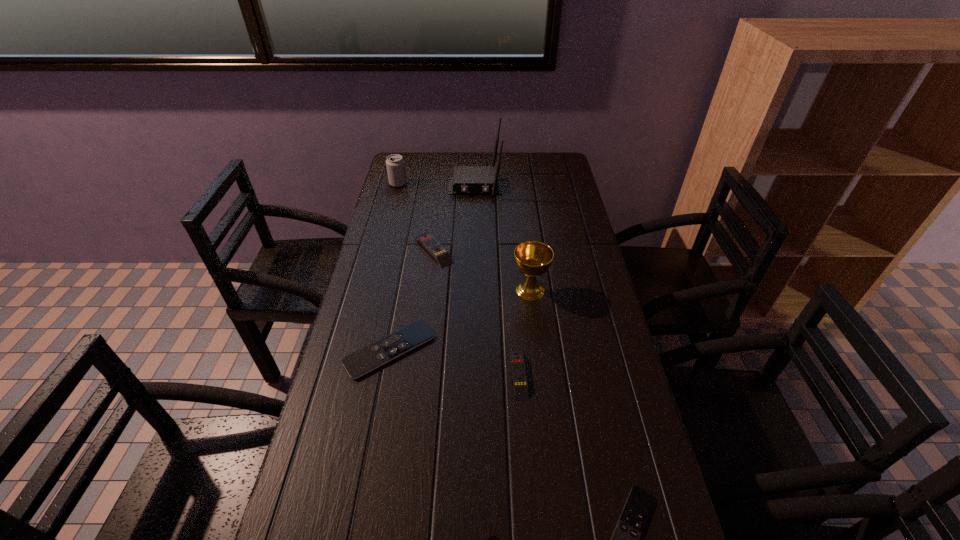
Image resolution: width=960 pixels, height=540 pixels. I want to click on object present at the far left corner, so click(395, 164).

The width and height of the screenshot is (960, 540). What are the coordinates of `free region at the far edge of the desktop` in the screenshot? It's located at (521, 171).

Where is `vacant space at the left edge of the desktop`? vacant space at the left edge of the desktop is located at coordinates (396, 271).

Locate an element on the screen. blank space at the right edge of the desktop is located at coordinates (545, 184).

Find the location of a particular element. This screenshot has height=540, width=960. blank space at the far right corner of the desktop is located at coordinates (566, 164).

Locate an element on the screen. Image resolution: width=960 pixels, height=540 pixels. empty space that is in between the gold chalice and the can is located at coordinates (465, 237).

Where is `free spot between the farthest remote control and the can`? The height and width of the screenshot is (540, 960). free spot between the farthest remote control and the can is located at coordinates (416, 217).

The image size is (960, 540). Identify the location of vacant point located between the router and the second remote control from right to left. (497, 280).

Where is `free space between the can and the router`? This screenshot has height=540, width=960. free space between the can and the router is located at coordinates (437, 185).

Identify which object is the third closest to the shortest object. Please provide its 2D coordinates. Your answer should be formatted as a tuple, i.e. [(x, y)], where the tuple contains the x and y coordinates of a point satisfying the conditions above.

[(376, 354)]